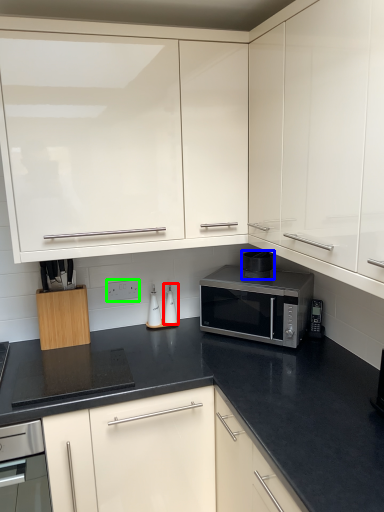
Question: Which object is the closest to the appliance (highlighted by a red box)? Choose among these: appliance (highlighted by a blue box) or electric outlet (highlighted by a green box).

Choices:
 (A) appliance
 (B) electric outlet

Answer: (B)